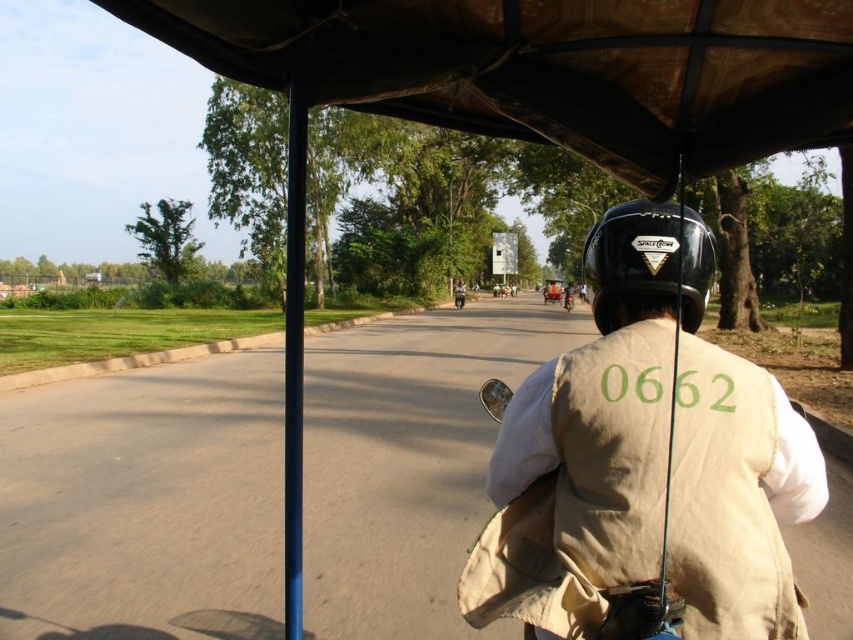
Question: In this image, where is beige fabric vest at center located relative to black matte helmet at center?

Choices:
 (A) above
 (B) below

Answer: (B)

Question: Which object appears farthest from the camera in this image?

Choices:
 (A) black matte helmet at center
 (B) beige fabric vest at center

Answer: (A)

Question: Among these points, which one is farthest from the camera?

Choices:
 (A) (708, 360)
 (B) (701, 234)

Answer: (B)

Question: Is beige fabric vest at center smaller than black matte helmet at center?

Choices:
 (A) no
 (B) yes

Answer: (A)

Question: Can you confirm if beige fabric vest at center is positioned to the left of black matte helmet at center?

Choices:
 (A) no
 (B) yes

Answer: (A)

Question: Which point is closer to the camera?

Choices:
 (A) (646, 218)
 (B) (755, 460)

Answer: (B)